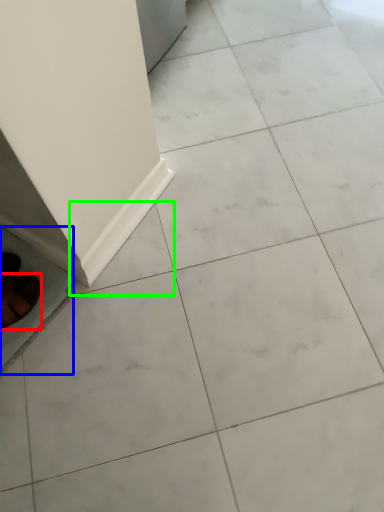
Question: Based on their relative distances, which object is farther from footwear (highlighted by a red box)? Choose from ceramic tile (highlighted by a blue box) and ceramic tile (highlighted by a green box).

Choices:
 (A) ceramic tile
 (B) ceramic tile

Answer: (B)